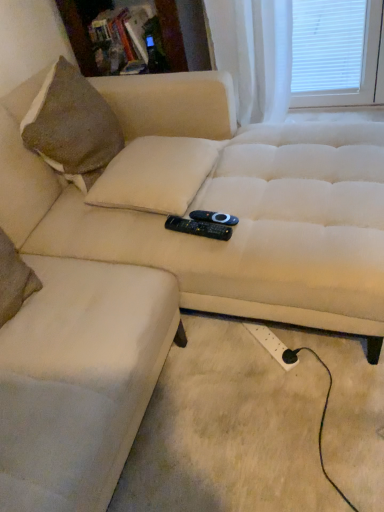
Question: From a real-world perspective, relative to black plastic remote at center, which ranks as the 1th remote in bottom-to-top order, is black plastic remote at center, the 2th remote from the bottom, vertically above or below?

Choices:
 (A) above
 (B) below

Answer: (B)

Question: Is black plastic remote at center, the 2th remote from the bottom, spatially inside black plastic remote at center, the second remote from the top, or outside of it?

Choices:
 (A) outside
 (B) inside

Answer: (A)

Question: Which object is positioned closest to the beige fabric pillow at center?

Choices:
 (A) white matte window screen at upper right
 (B) white plastic extension cord at lower right
 (C) black plastic remote at center, which ranks as the 1th remote in bottom-to-top order
 (D) wooden bookshelf at upper center
 (E) beige fabric ottoman at left

Answer: (C)

Question: Which object is the closest to the black plastic remote at center, the 1th remote positioned from the top?

Choices:
 (A) white sheer curtain at upper right
 (B) beige fabric pillow at center
 (C) beige fabric ottoman at left
 (D) white matte window screen at upper right
 (E) white plastic extension cord at lower right

Answer: (B)